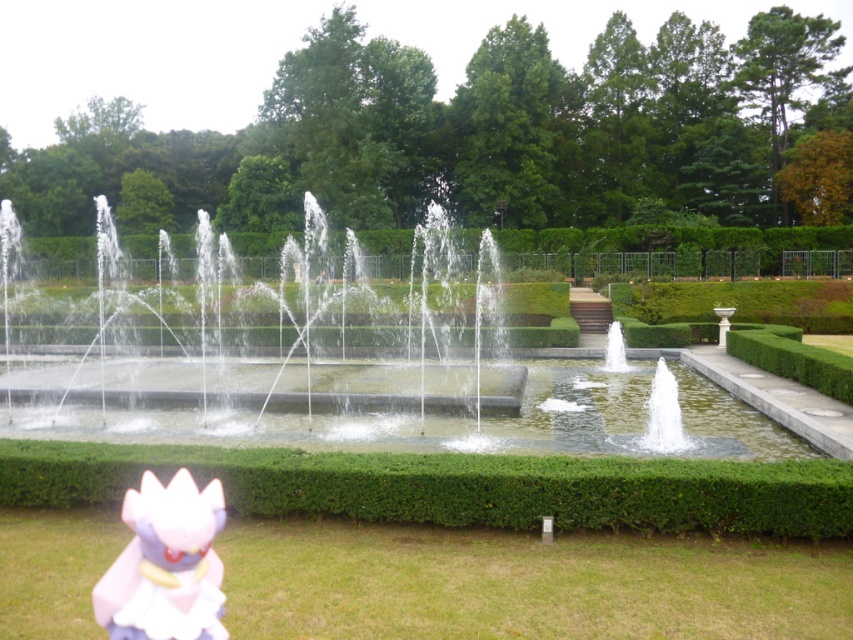
You are standing at the center of the garden facing the fountain. There is a point marked at coordinates (166, 563). Which object is this point located on?

The point at coordinates (166, 563) is located on the pink matte plush at lower left.

Consider the image. You are designing a new garden layout and want to place a decorative statue that is 1 meter wide. You have the pink matte plush at lower left and the clear glass water at center in the current design. Which object can accommodate the statue without overlapping based on their widths?

The clear glass water at center has a greater width than the pink matte plush at lower left, so placing the 1 meter wide statue next to or near the clear glass water at center would be more feasible as it has sufficient space.

You are a photographer standing at the camera position. You want to take a clear photo of the pink matte plush at lower left. Can you move closer to the plush to make it the main focus of your photo?

The pink matte plush at lower left is 3.77 meters from camera. Since you can move closer, you can reduce the distance to make it the main focus.